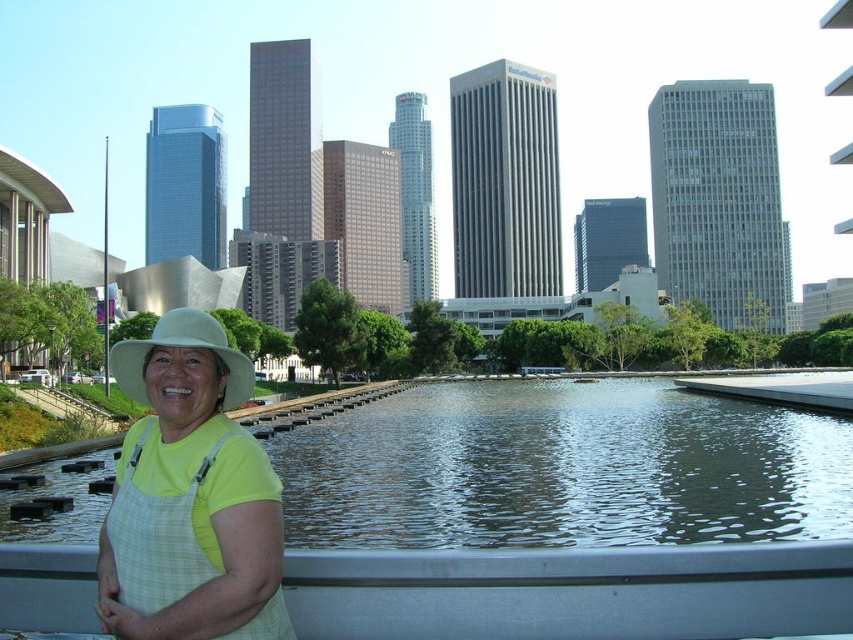
You are a photographer trying to capture the Walt Disney Concert Hall in the background. You notice two points marked in the scene, point [149,342] and point [154,333]. Which point should you focus on to ensure the background landmark is in sharp focus?

You should focus on point [154,333] because it is farther from the camera compared to point [149,342], allowing the background to be in focus.

You are a photographer trying to capture the city skyline with both the woman and the landmarks in focus. You notice two points in the scene labeled as point 1 at coordinates point [454,474] and point 2 at coordinates point [206,593]. Which point is closer to the camera?

Point 1 at coordinates point [454,474] is closer to the camera than point 2 at coordinates point [206,593] because it is further to the camera than point 2.